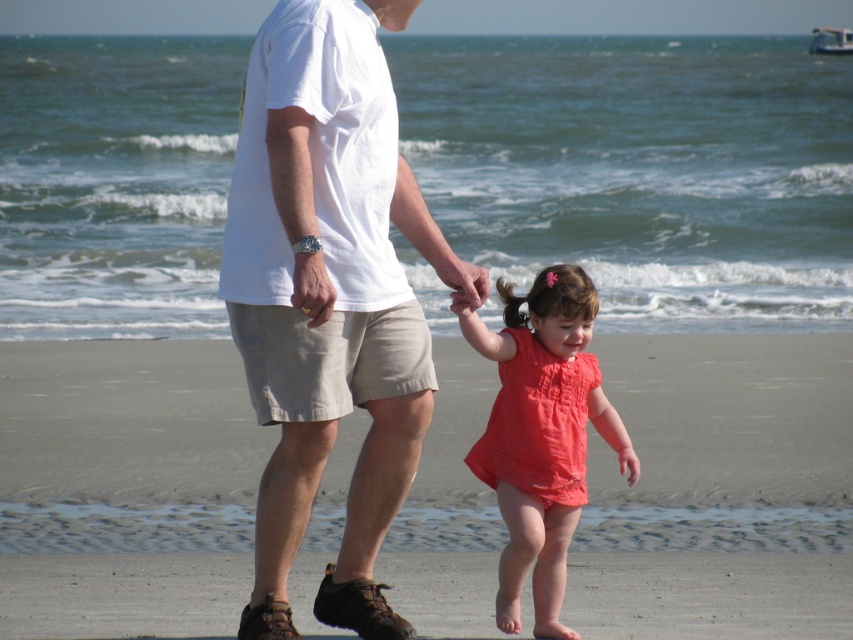
Question: From the image, what is the correct spatial relationship of smooth sand at lower center in relation to white cotton shirt at center?

Choices:
 (A) left
 (B) right

Answer: (B)

Question: Is matte coral dress at center to the left of matte skin hand at center from the viewer's perspective?

Choices:
 (A) yes
 (B) no

Answer: (B)

Question: Which point is farther from the camera taking this photo?

Choices:
 (A) (432, 244)
 (B) (172, 348)

Answer: (B)

Question: Which object is positioned farthest from the matte skin hand at center?

Choices:
 (A) matte coral dress at center
 (B) smooth sand at lower center

Answer: (B)

Question: Which is nearer to the matte skin hand at center?

Choices:
 (A) smooth sand at lower center
 (B) matte coral dress at center
 (C) white cotton shirt at center

Answer: (B)

Question: Is white cotton shirt at center to the right of matte skin hand at center from the viewer's perspective?

Choices:
 (A) no
 (B) yes

Answer: (A)